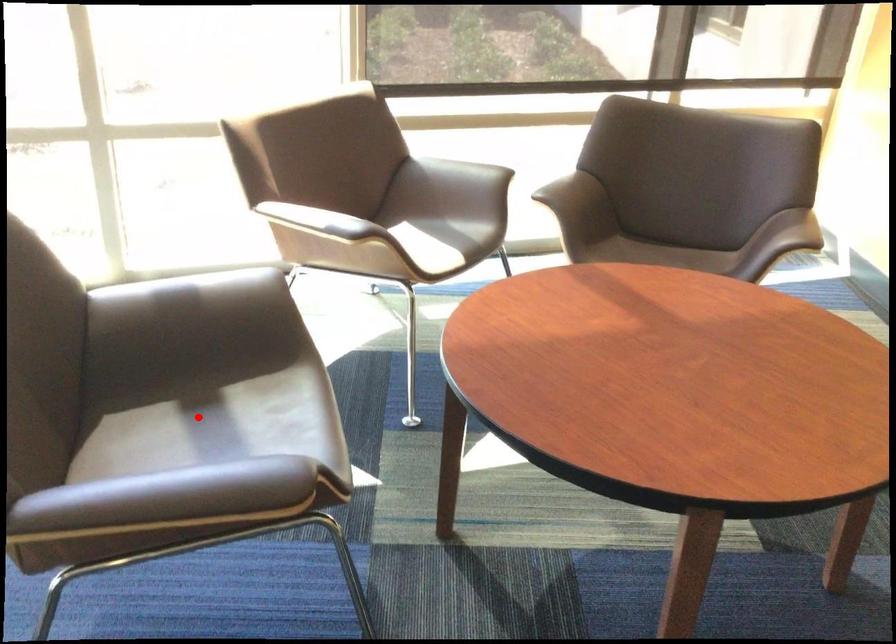
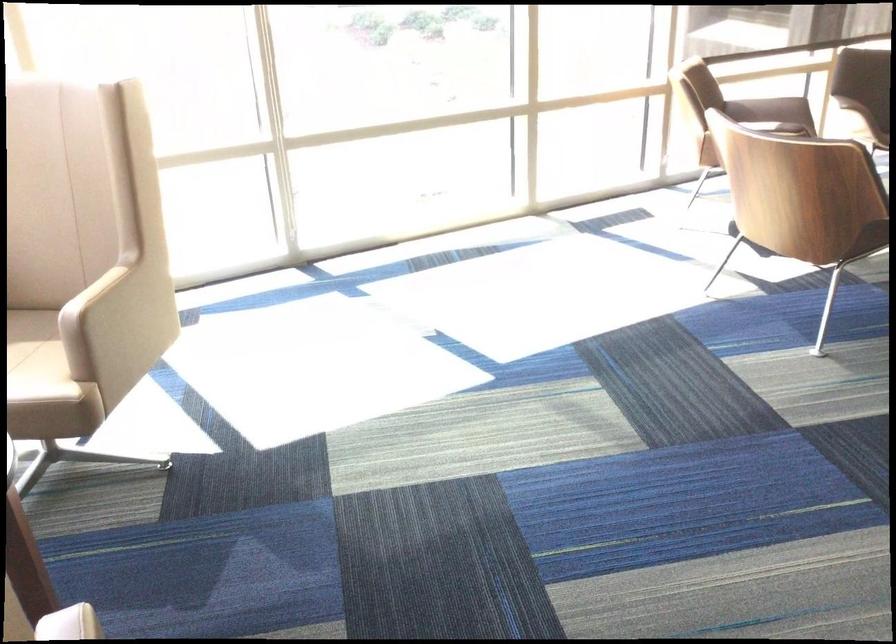
Question: I am providing you with two images of the same scene from different viewpoints. A red point is marked on the first image. Can you still see the location of the red point in image 2?

Choices:
 (A) Yes
 (B) No

Answer: (B)